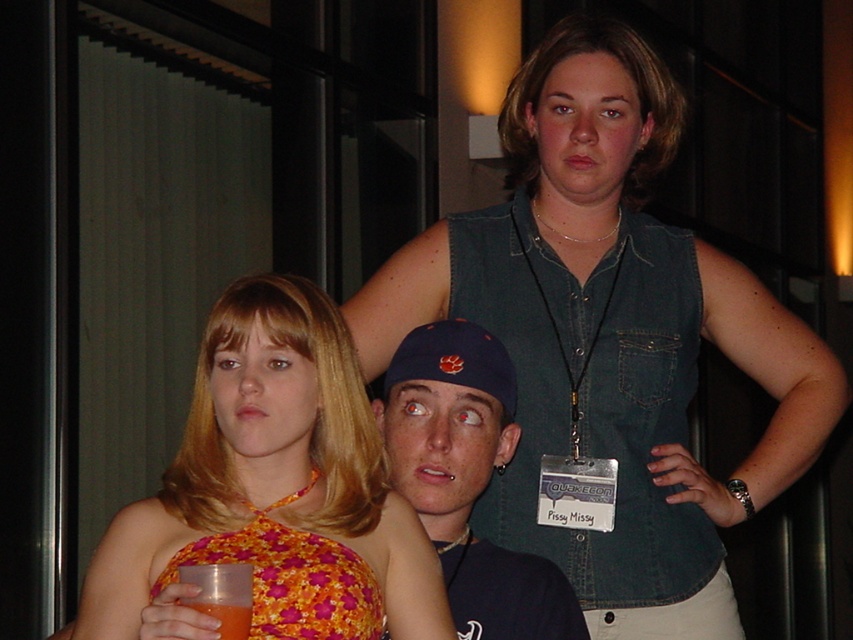
You are a photographer setting up for a group photo. You need to ensure that the floral halter top at center and the matte blue cap at center are both visible in the frame. Based on their sizes, which object should you prioritize keeping centered to avoid being cut off?

The floral halter top at center is wider than the matte blue cap at center, so prioritizing the floral halter top at center to stay centered would ensure it fits within the frame without being cut off.

You are standing in the same room as the three people in the image. You want to reach the point closer to the camera. Which point should you walk towards, point (384, 269) or point (225, 602)?

You should walk towards point (384, 269) because it is further to the camera than point (225, 602).